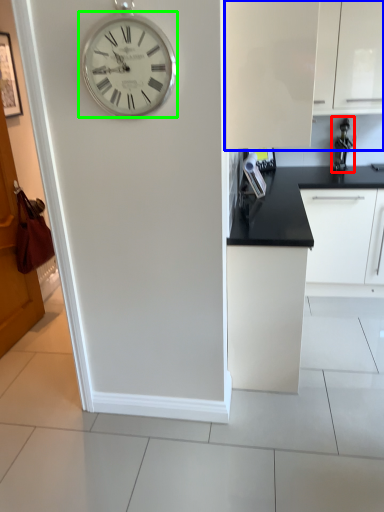
Question: Which object is the closest to the appliance (highlighted by a red box)? Choose among these: cabinetry (highlighted by a blue box) or wall clock (highlighted by a green box).

Choices:
 (A) cabinetry
 (B) wall clock

Answer: (A)